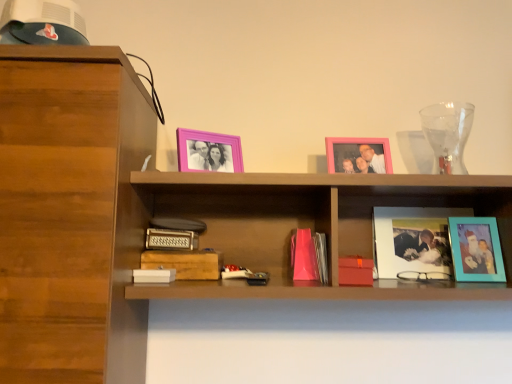
Question: Is wooden paperback book at center, marked as the 3th paperback book in a left-to-right arrangement, shorter than pink matte picture frame at upper center, the third picture frame in the right-to-left sequence?

Choices:
 (A) yes
 (B) no

Answer: (A)

Question: Is wooden paperback book at center, which is counted as the 2th paperback book, starting from the right, completely or partially outside of pink matte picture frame at upper center, the third picture frame in the right-to-left sequence?

Choices:
 (A) no
 (B) yes

Answer: (B)

Question: Would you say wooden paperback book at center, which is counted as the 2th paperback book, starting from the right, is a long distance from pink matte picture frame at upper center, the third picture frame in the right-to-left sequence?

Choices:
 (A) no
 (B) yes

Answer: (A)

Question: Is wooden paperback book at center, marked as the 3th paperback book in a left-to-right arrangement, oriented away from pink matte picture frame at upper center, the second picture frame viewed from the left?

Choices:
 (A) no
 (B) yes

Answer: (A)

Question: From the image's perspective, is wooden paperback book at center, which is counted as the 2th paperback book, starting from the right, below pink matte picture frame at upper center, the second picture frame viewed from the left?

Choices:
 (A) no
 (B) yes

Answer: (B)

Question: From a real-world perspective, is wooden paperback book at center, which is counted as the 2th paperback book, starting from the right, on top of pink matte picture frame at upper center, the third picture frame in the right-to-left sequence?

Choices:
 (A) yes
 (B) no

Answer: (B)

Question: Does wooden paperback book at center, marked as the 3th paperback book in a left-to-right arrangement, have a lesser width compared to teal matte picture frame at right, the fourth picture frame positioned from the left?

Choices:
 (A) no
 (B) yes

Answer: (A)

Question: Can we say wooden paperback book at center, which is counted as the 2th paperback book, starting from the right, lies outside teal matte picture frame at right, the first picture frame from the right?

Choices:
 (A) yes
 (B) no

Answer: (A)

Question: Is the position of wooden paperback book at center, which is counted as the 2th paperback book, starting from the right, more distant than that of teal matte picture frame at right, the first picture frame from the right?

Choices:
 (A) no
 (B) yes

Answer: (A)

Question: Is wooden paperback book at center, marked as the 3th paperback book in a left-to-right arrangement, oriented towards teal matte picture frame at right, the fourth picture frame positioned from the left?

Choices:
 (A) yes
 (B) no

Answer: (B)

Question: Does wooden paperback book at center, which is counted as the 2th paperback book, starting from the right, have a larger size compared to teal matte picture frame at right, the first picture frame from the right?

Choices:
 (A) yes
 (B) no

Answer: (A)

Question: From a real-world perspective, is wooden paperback book at center, marked as the 3th paperback book in a left-to-right arrangement, under teal matte picture frame at right, the first picture frame from the right?

Choices:
 (A) no
 (B) yes

Answer: (B)

Question: From a real-world perspective, is matte glass photo frame at center right, positioned as the 3th picture frame in left-to-right order, beneath transparent glass vase at upper right?

Choices:
 (A) no
 (B) yes

Answer: (B)